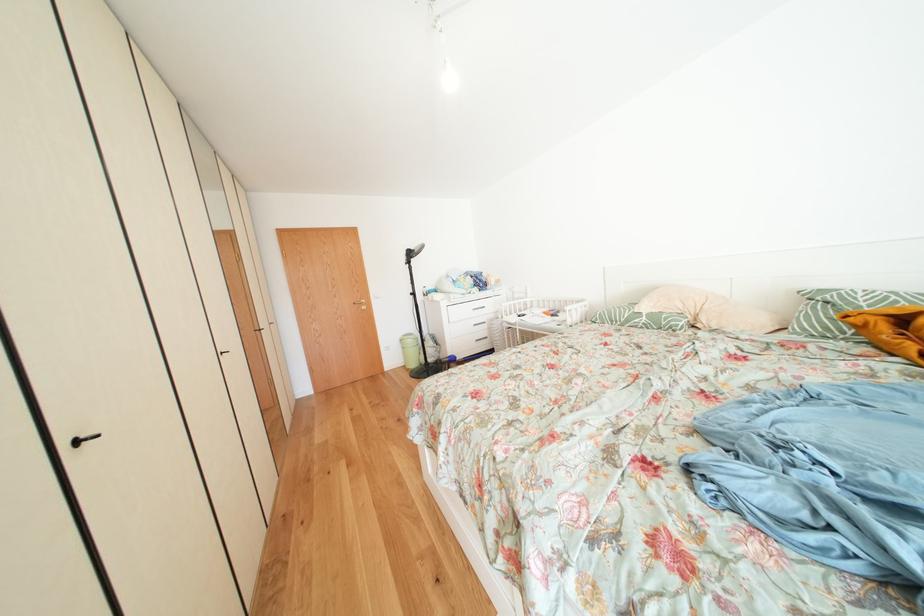
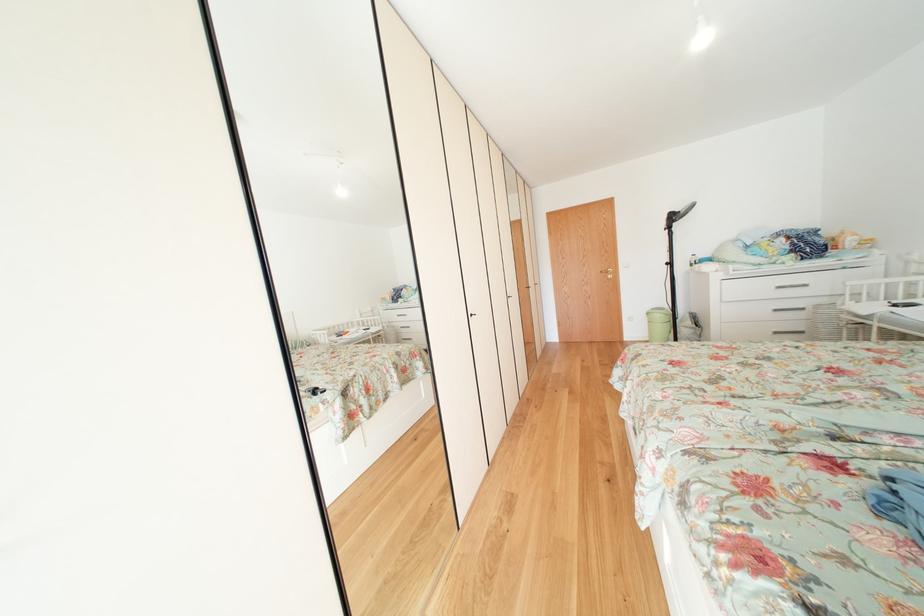
Locate, in the second image, the point that corresponds to the point at 484,330 in the first image.

(784, 315)